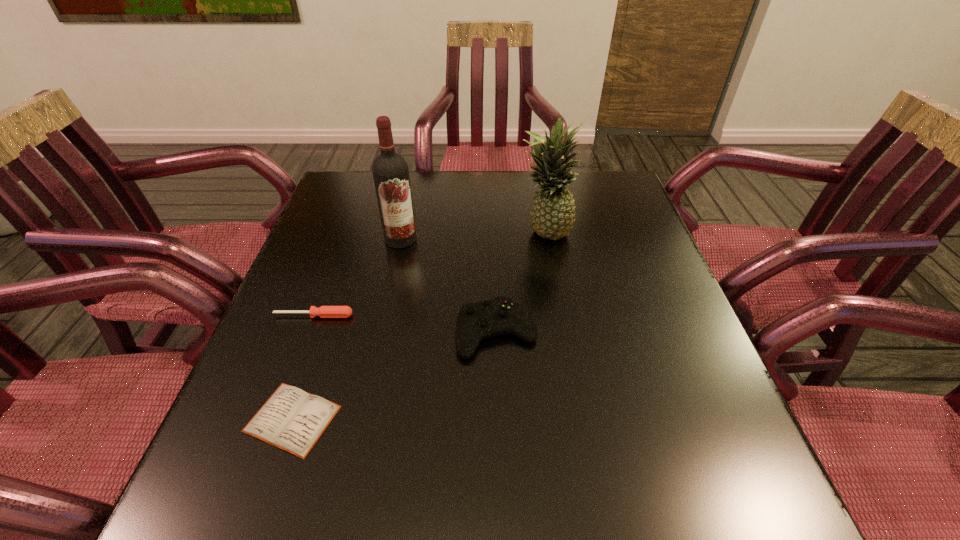
This screenshot has width=960, height=540. Identify the location of object that stands as the closest to the wine bottle. point(324,311).

Identify which object is the second nearest to the second shortest object. Please provide its 2D coordinates. Your answer should be formatted as a tuple, i.e. [(x, y)], where the tuple contains the x and y coordinates of a point satisfying the conditions above.

[(390, 171)]

Find the location of a particular element. free location that satisfies the following two spatial constraints: 1. on the label of the wine bottle; 2. on the left side of the control is located at coordinates (381, 332).

At what (x,y) coordinates should I click in order to perform the action: click on vacant point that satisfies the following two spatial constraints: 1. on the back side of the diary; 2. on the left side of the third shortest object. Please return your answer as a coordinate pair (x, y). The height and width of the screenshot is (540, 960). Looking at the image, I should click on (322, 332).

Where is `free spot that satisfies the following two spatial constraints: 1. on the label of the wine bottle; 2. on the left side of the control`? free spot that satisfies the following two spatial constraints: 1. on the label of the wine bottle; 2. on the left side of the control is located at coordinates (381, 332).